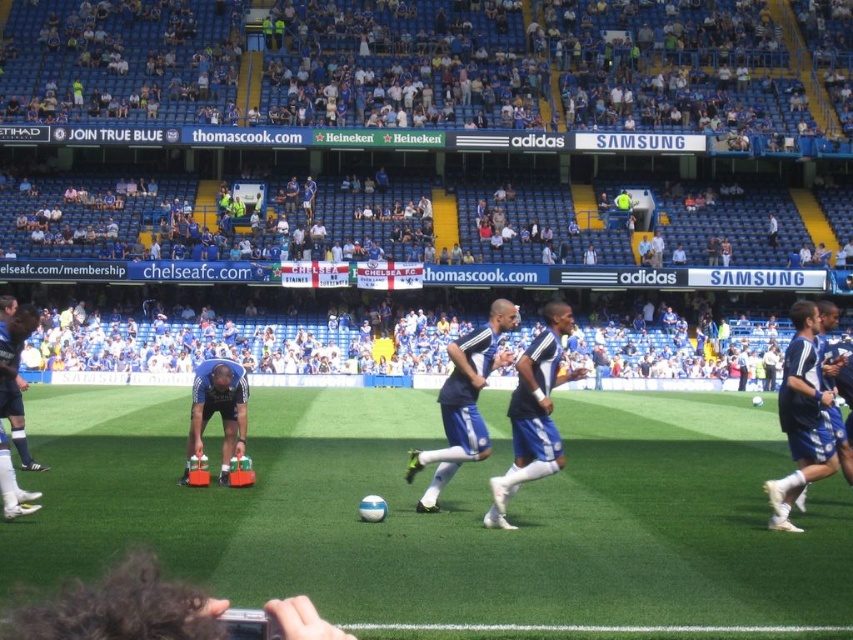
Question: From the image, what is the correct spatial relationship of white synthetic turf at center in relation to blue fabric shorts at center?

Choices:
 (A) below
 (B) above

Answer: (A)

Question: Which object appears closest to the camera in this image?

Choices:
 (A) white synthetic turf at center
 (B) blue fabric shorts at center

Answer: (A)

Question: Can you confirm if white synthetic turf at center is positioned above blue fabric shorts at center?

Choices:
 (A) no
 (B) yes

Answer: (A)

Question: Observing the image, what is the correct spatial positioning of white synthetic turf at center in reference to blue fabric shorts at center?

Choices:
 (A) above
 (B) below

Answer: (B)

Question: Which point is farther to the camera?

Choices:
 (A) white synthetic turf at center
 (B) blue fabric shorts at center

Answer: (B)

Question: Which of the following is the closest to the observer?

Choices:
 (A) white synthetic turf at center
 (B) blue fabric shorts at center

Answer: (A)